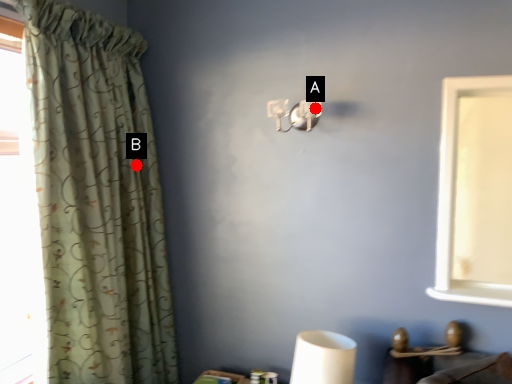
Question: Two points are circled on the image, labeled by A and B beside each circle. Which point is closer to the camera taking this photo?

Choices:
 (A) A is closer
 (B) B is closer

Answer: (A)